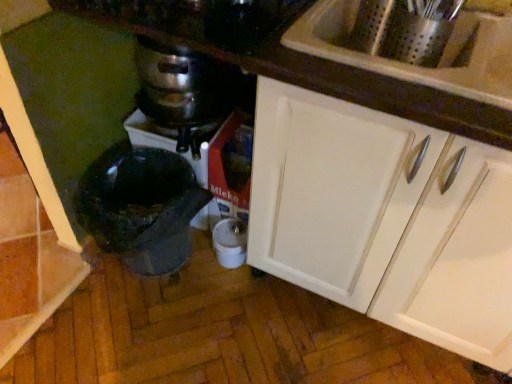
This screenshot has width=512, height=384. What do you see at coordinates (230, 242) in the screenshot?
I see `white plastic container at lower center, marked as the 2th appliance in a left-to-right arrangement` at bounding box center [230, 242].

Image resolution: width=512 pixels, height=384 pixels. What are the coordinates of `white plastic container at lower center, marked as the 2th appliance in a left-to-right arrangement` in the screenshot? It's located at (230, 242).

Image resolution: width=512 pixels, height=384 pixels. What do you see at coordinates (141, 206) in the screenshot?
I see `black matte mortar at lower left, placed as the 1th appliance when sorted from left to right` at bounding box center [141, 206].

What are the coordinates of `white glossy sink at upper right` in the screenshot? It's located at (418, 66).

Where is `stainless steel pot at center`? Image resolution: width=512 pixels, height=384 pixels. stainless steel pot at center is located at coordinates (182, 85).

How different are the orientations of white glossy cabinet at upper right and white glossy sink at upper right in degrees?

The angle between the facing direction of white glossy cabinet at upper right and the facing direction of white glossy sink at upper right is 0.589 degrees.

Who is shorter, white glossy cabinet at upper right or white glossy sink at upper right?

Standing shorter between the two is white glossy sink at upper right.

From the picture: Is white glossy cabinet at upper right facing towards white glossy sink at upper right?

No.

Does white glossy cabinet at upper right appear on the right side of white glossy sink at upper right?

Yes, white glossy cabinet at upper right is to the right of white glossy sink at upper right.

Which object is wider, white plastic container at lower center, the first appliance in the right-to-left sequence, or black matte mortar at lower left, which is the second appliance in right-to-left order?

black matte mortar at lower left, which is the second appliance in right-to-left order.

Are white plastic container at lower center, the first appliance in the right-to-left sequence, and black matte mortar at lower left, placed as the 1th appliance when sorted from left to right, making contact?

No.

Based on the photo, is white plastic container at lower center, the first appliance in the right-to-left sequence, taller than black matte mortar at lower left, placed as the 1th appliance when sorted from left to right?

In fact, white plastic container at lower center, the first appliance in the right-to-left sequence, may be shorter than black matte mortar at lower left, placed as the 1th appliance when sorted from left to right.

Considering the sizes of white plastic container at lower center, the first appliance in the right-to-left sequence, and stainless steel pot at center in the image, is white plastic container at lower center, the first appliance in the right-to-left sequence, wider or thinner than stainless steel pot at center?

In the image, white plastic container at lower center, the first appliance in the right-to-left sequence, appears to be more narrow than stainless steel pot at center.

Is white plastic container at lower center, marked as the 2th appliance in a left-to-right arrangement, positioned with its back to stainless steel pot at center?

No, white plastic container at lower center, marked as the 2th appliance in a left-to-right arrangement, is not facing away from stainless steel pot at center.

Can you see white plastic container at lower center, marked as the 2th appliance in a left-to-right arrangement, touching stainless steel pot at center?

No, white plastic container at lower center, marked as the 2th appliance in a left-to-right arrangement, is not in contact with stainless steel pot at center.

From a real-world perspective, is white plastic container at lower center, the first appliance in the right-to-left sequence, on stainless steel pot at center?

Incorrect, from a real-world perspective, white plastic container at lower center, the first appliance in the right-to-left sequence, is lower than stainless steel pot at center.

Considering the sizes of white glossy cabinet at upper right and stainless steel pot at center in the image, is white glossy cabinet at upper right bigger or smaller than stainless steel pot at center?

Clearly, white glossy cabinet at upper right is larger in size than stainless steel pot at center.

Which point is more forward, (452,220) or (218,80)?

The point (452,220) is more forward.

From a real-world perspective, is white glossy cabinet at upper right physically below stainless steel pot at center?

Correct, in the physical world, white glossy cabinet at upper right is lower than stainless steel pot at center.

Which object is thinner, white glossy cabinet at upper right or stainless steel pot at center?

Thinner between the two is stainless steel pot at center.

Considering the relative sizes of black matte mortar at lower left, which is the second appliance in right-to-left order, and white plastic container at lower center, the first appliance in the right-to-left sequence, in the image provided, is black matte mortar at lower left, which is the second appliance in right-to-left order, shorter than white plastic container at lower center, the first appliance in the right-to-left sequence,?

Incorrect, the height of black matte mortar at lower left, which is the second appliance in right-to-left order, does not fall short of that of white plastic container at lower center, the first appliance in the right-to-left sequence.

What's the angular difference between black matte mortar at lower left, which is the second appliance in right-to-left order, and white plastic container at lower center, marked as the 2th appliance in a left-to-right arrangement,'s facing directions?

black matte mortar at lower left, which is the second appliance in right-to-left order, and white plastic container at lower center, marked as the 2th appliance in a left-to-right arrangement, are facing 6.73 degrees away from each other.

Considering the relative positions of black matte mortar at lower left, which is the second appliance in right-to-left order, and white plastic container at lower center, marked as the 2th appliance in a left-to-right arrangement, in the image provided, is black matte mortar at lower left, which is the second appliance in right-to-left order, to the right of white plastic container at lower center, marked as the 2th appliance in a left-to-right arrangement, from the viewer's perspective?

No.

Could you measure the distance between black matte mortar at lower left, which is the second appliance in right-to-left order, and white plastic container at lower center, marked as the 2th appliance in a left-to-right arrangement?

The distance of black matte mortar at lower left, which is the second appliance in right-to-left order, from white plastic container at lower center, marked as the 2th appliance in a left-to-right arrangement, is 10.89 inches.

From the image's perspective, which one is positioned lower, white glossy sink at upper right or black matte mortar at lower left, placed as the 1th appliance when sorted from left to right?

From the image's view, black matte mortar at lower left, placed as the 1th appliance when sorted from left to right, is below.

Is white glossy sink at upper right wider than black matte mortar at lower left, which is the second appliance in right-to-left order?

Yes, white glossy sink at upper right is wider than black matte mortar at lower left, which is the second appliance in right-to-left order.

Is white glossy sink at upper right inside the boundaries of black matte mortar at lower left, which is the second appliance in right-to-left order, or outside?

A: white glossy sink at upper right is outside black matte mortar at lower left, which is the second appliance in right-to-left order.

Based on the photo, is white glossy sink at upper right placed right next to black matte mortar at lower left, which is the second appliance in right-to-left order?

No, white glossy sink at upper right is not next to black matte mortar at lower left, which is the second appliance in right-to-left order.

From the image's perspective, between stainless steel pot at center and black matte mortar at lower left, placed as the 1th appliance when sorted from left to right, which one is located above?

From the image's view, stainless steel pot at center is above.

Which of these two, stainless steel pot at center or black matte mortar at lower left, which is the second appliance in right-to-left order, stands shorter?

With less height is stainless steel pot at center.

Who is smaller, stainless steel pot at center or black matte mortar at lower left, placed as the 1th appliance when sorted from left to right?

stainless steel pot at center is smaller.

Based on the photo, considering the relative sizes of stainless steel pot at center and black matte mortar at lower left, which is the second appliance in right-to-left order, in the image provided, is stainless steel pot at center thinner than black matte mortar at lower left, which is the second appliance in right-to-left order,?

Indeed, stainless steel pot at center has a lesser width compared to black matte mortar at lower left, which is the second appliance in right-to-left order.

Where is `sink above the white glossy cabinet at upper right (from the image's perspective)`? The height and width of the screenshot is (384, 512). sink above the white glossy cabinet at upper right (from the image's perspective) is located at coordinates (418, 66).

Where is `appliance lying on the right of black matte mortar at lower left, placed as the 1th appliance when sorted from left to right`? The height and width of the screenshot is (384, 512). appliance lying on the right of black matte mortar at lower left, placed as the 1th appliance when sorted from left to right is located at coordinates (230, 242).

Considering their positions, is white glossy cabinet at upper right positioned further to white glossy sink at upper right than stainless steel pot at center?

stainless steel pot at center is positioned further to the anchor white glossy sink at upper right.

Looking at the image, which one is located closer to stainless steel pot at center, white glossy cabinet at upper right or black matte mortar at lower left, which is the second appliance in right-to-left order?

Based on the image, black matte mortar at lower left, which is the second appliance in right-to-left order, appears to be nearer to stainless steel pot at center.

From the image, which object appears to be nearer to white plastic container at lower center, the first appliance in the right-to-left sequence, white glossy sink at upper right or black matte mortar at lower left, which is the second appliance in right-to-left order?

Among the two, black matte mortar at lower left, which is the second appliance in right-to-left order, is located nearer to white plastic container at lower center, the first appliance in the right-to-left sequence.

Looking at the image, which one is located closer to white glossy sink at upper right, white plastic container at lower center, marked as the 2th appliance in a left-to-right arrangement, or white glossy cabinet at upper right?

Among the two, white glossy cabinet at upper right is located nearer to white glossy sink at upper right.

Considering their positions, is stainless steel pot at center positioned closer to white glossy cabinet at upper right than white plastic container at lower center, the first appliance in the right-to-left sequence?

Among the two, white plastic container at lower center, the first appliance in the right-to-left sequence, is located nearer to white glossy cabinet at upper right.

From the image, which object appears to be nearer to black matte mortar at lower left, placed as the 1th appliance when sorted from left to right, white glossy cabinet at upper right or white glossy sink at upper right?

The object closer to black matte mortar at lower left, placed as the 1th appliance when sorted from left to right, is white glossy cabinet at upper right.

Looking at the image, which one is located further to stainless steel pot at center, white glossy cabinet at upper right or white plastic container at lower center, the first appliance in the right-to-left sequence?

white glossy cabinet at upper right lies further to stainless steel pot at center than the other object.

Which object lies further to the anchor point white glossy sink at upper right, black matte mortar at lower left, which is the second appliance in right-to-left order, or stainless steel pot at center?

The object further to white glossy sink at upper right is black matte mortar at lower left, which is the second appliance in right-to-left order.

This screenshot has height=384, width=512. What are the coordinates of `appliance between black matte mortar at lower left, placed as the 1th appliance when sorted from left to right, and white glossy sink at upper right from left to right` in the screenshot? It's located at (230, 242).

Locate an element on the screen. The width and height of the screenshot is (512, 384). appliance between black matte mortar at lower left, placed as the 1th appliance when sorted from left to right, and white glossy cabinet at upper right from left to right is located at coordinates (230, 242).

Where is `kitchen appliance between black matte mortar at lower left, placed as the 1th appliance when sorted from left to right, and white glossy sink at upper right, in the horizontal direction`? Image resolution: width=512 pixels, height=384 pixels. kitchen appliance between black matte mortar at lower left, placed as the 1th appliance when sorted from left to right, and white glossy sink at upper right, in the horizontal direction is located at coordinates (182, 85).

The height and width of the screenshot is (384, 512). In order to click on sink between white glossy cabinet at upper right and white plastic container at lower center, marked as the 2th appliance in a left-to-right arrangement, in the front-back direction in this screenshot , I will do `click(418, 66)`.